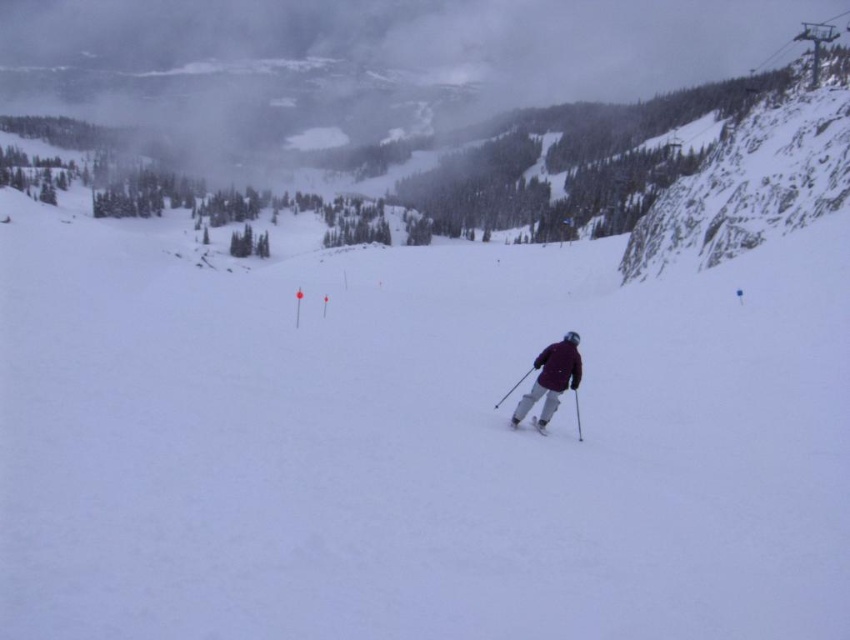
Can you confirm if maroon fabric jacket at center is wider than matte gray ski at center?

Correct, the width of maroon fabric jacket at center exceeds that of matte gray ski at center.

Is point (565, 380) closer to viewer compared to point (533, 419)?

No.

Where is `maroon fabric jacket at center`? The image size is (850, 640). maroon fabric jacket at center is located at coordinates (551, 378).